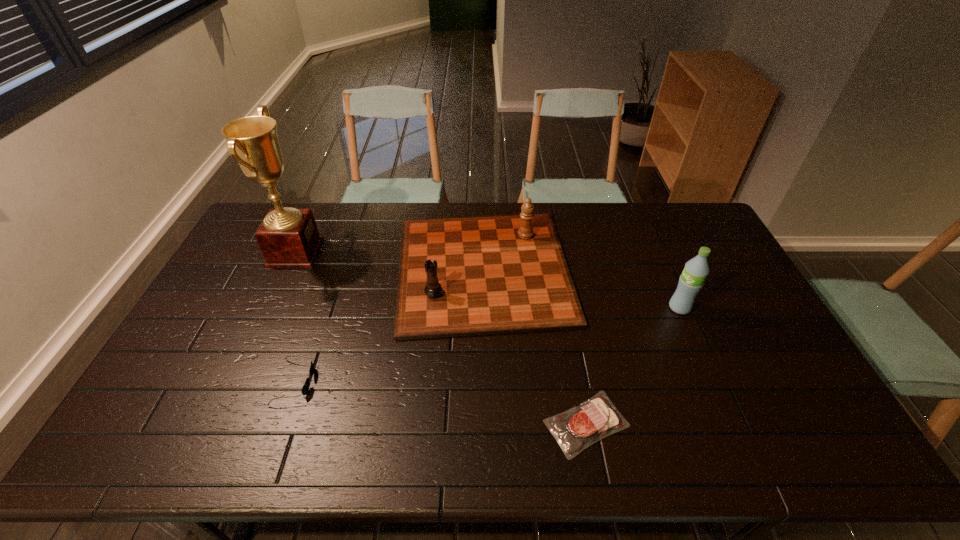
Identify the location of vacant region that satisfies the following two spatial constraints: 1. on the back side of the third tallest object; 2. on the plaque of the leftmost object. The image size is (960, 540). (483, 252).

The height and width of the screenshot is (540, 960). In order to click on vacant point that satisfies the following two spatial constraints: 1. on the plaque of the leftmost object; 2. on the back side of the water bottle in this screenshot , I will do `click(270, 308)`.

This screenshot has height=540, width=960. Find the location of `vacant region that satisfies the following two spatial constraints: 1. on the plaque of the third shortest object; 2. on the left side of the leftmost object`. vacant region that satisfies the following two spatial constraints: 1. on the plaque of the third shortest object; 2. on the left side of the leftmost object is located at coordinates (288, 269).

The height and width of the screenshot is (540, 960). I want to click on vacant position in the image that satisfies the following two spatial constraints: 1. on the plaque of the gameboard; 2. on the right side of the tallest object, so click(x=288, y=269).